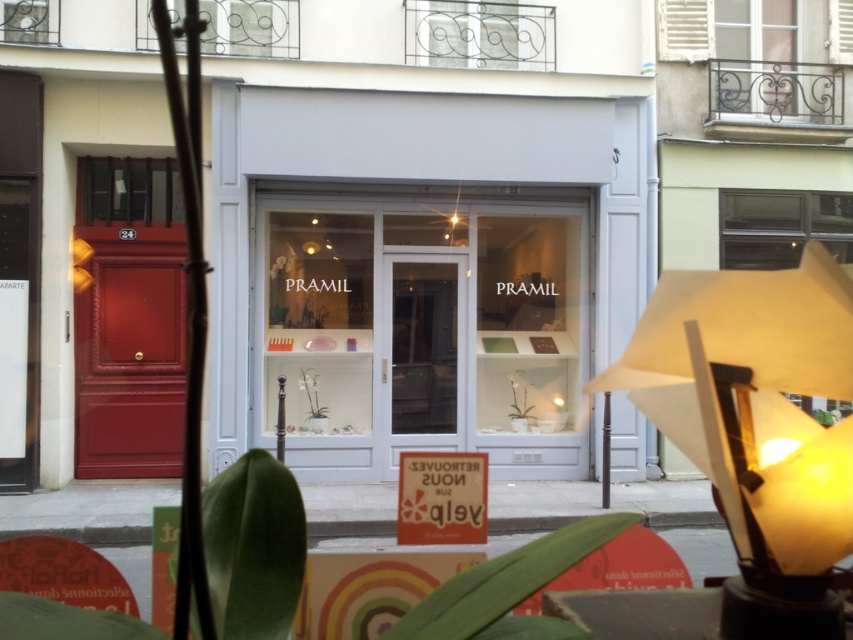
Who is more distant from viewer, [96,198] or [756,211]?

Positioned behind is point [756,211].

Does smooth glossy door at left come in front of clear glass window at upper right?

Yes, smooth glossy door at left is closer to the viewer.

Who is more distant from viewer, (178, 385) or (846, 220)?

The point (846, 220) is more distant.

You are a GUI agent. You are given a task and a screenshot of the screen. Output one action in this format:
    pyautogui.click(x=<x>, y=<y>)
    Task: Click on the smooth glossy door at left
    This screenshot has width=853, height=640.
    Given the screenshot: What is the action you would take?
    pyautogui.click(x=128, y=317)

Who is higher up, smooth glossy door at left or green leafy plant at lower center?

smooth glossy door at left is above.

Can you confirm if smooth glossy door at left is smaller than green leafy plant at lower center?

No, smooth glossy door at left is not smaller than green leafy plant at lower center.

Is point (171, 237) positioned in front of point (534, 637)?

No, (171, 237) is behind (534, 637).

The height and width of the screenshot is (640, 853). I want to click on smooth glossy door at left, so pos(128,317).

Can you confirm if transparent glass shop window at center is shorter than clear glass window at upper right?

Incorrect, transparent glass shop window at center's height does not fall short of clear glass window at upper right's.

In the scene shown: Does transparent glass shop window at center have a smaller size compared to clear glass window at upper right?

No, transparent glass shop window at center is not smaller than clear glass window at upper right.

From the picture: Measure the distance between point (334, 429) and camera.

A distance of 10.42 meters exists between point (334, 429) and camera.

The image size is (853, 640). Find the location of `transparent glass shop window at center`. transparent glass shop window at center is located at coordinates (422, 333).